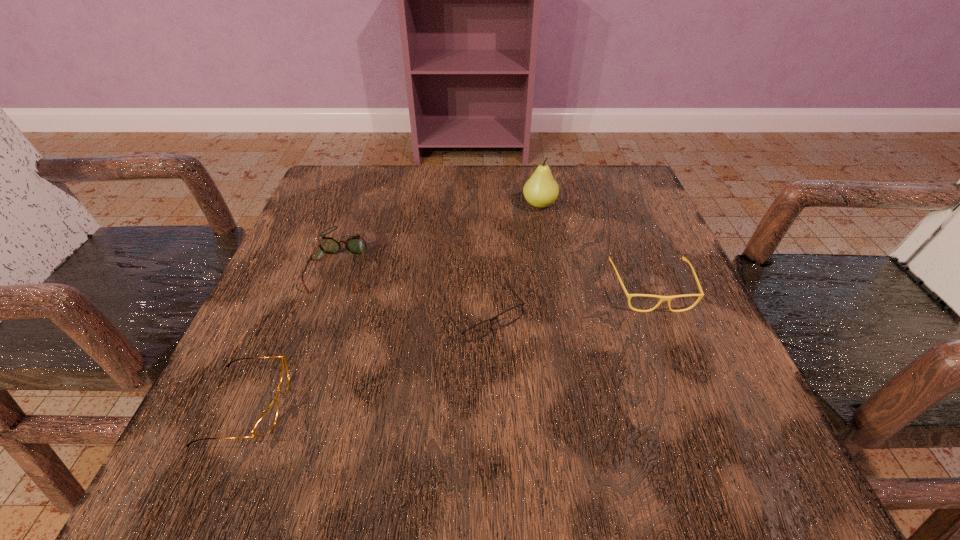
You are a GUI agent. You are given a task and a screenshot of the screen. Output one action in this format:
    pyautogui.click(x=<x>, y=<y>)
    Task: Click on the blank region between the second object from right to left and the third spectacles from left to right
    
    Given the screenshot: What is the action you would take?
    pyautogui.click(x=512, y=261)

The width and height of the screenshot is (960, 540). Find the location of `empty location between the nearest spectacles and the farthest object`. empty location between the nearest spectacles and the farthest object is located at coordinates (394, 305).

Locate an element on the screen. unoccupied area between the tallest object and the rightmost spectacles is located at coordinates (595, 247).

Where is `free space between the tallest object and the nearest spectacles`? The width and height of the screenshot is (960, 540). free space between the tallest object and the nearest spectacles is located at coordinates (394, 305).

Locate an element on the screen. unoccupied area between the third object from right to left and the second object from right to left is located at coordinates (512, 261).

Choose which object is the nearest neighbor to the rightmost object. Please provide its 2D coordinates. Your answer should be formatted as a tuple, i.e. [(x, y)], where the tuple contains the x and y coordinates of a point satisfying the conditions above.

[(510, 315)]

Where is `object that is the fourth nearest to the tallest object`? This screenshot has height=540, width=960. object that is the fourth nearest to the tallest object is located at coordinates (266, 422).

You are a GUI agent. You are given a task and a screenshot of the screen. Output one action in this format:
    pyautogui.click(x=<x>, y=<y>)
    Task: Click on the spectacles that can be found as the fourth closest to the farthest object
    
    Given the screenshot: What is the action you would take?
    click(x=266, y=422)

Locate an element on the screen. The width and height of the screenshot is (960, 540). spectacles that stands as the third closest to the rightmost object is located at coordinates (266, 422).

Where is `vacant space that satisfies the following two spatial constraints: 1. in front of the lenses of the rightmost object; 2. on the front-facing side of the nearest object`? Image resolution: width=960 pixels, height=540 pixels. vacant space that satisfies the following two spatial constraints: 1. in front of the lenses of the rightmost object; 2. on the front-facing side of the nearest object is located at coordinates (698, 406).